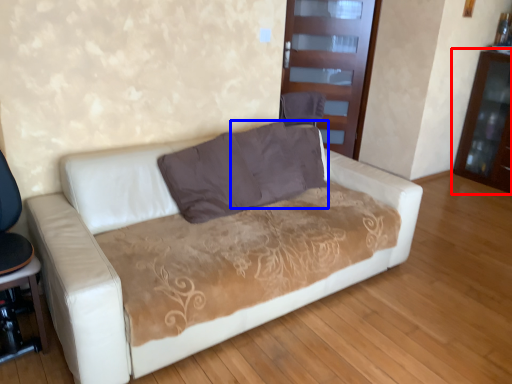
Question: Which object is closer to the camera taking this photo, dresser (highlighted by a red box) or pillow (highlighted by a blue box)?

Choices:
 (A) dresser
 (B) pillow

Answer: (B)